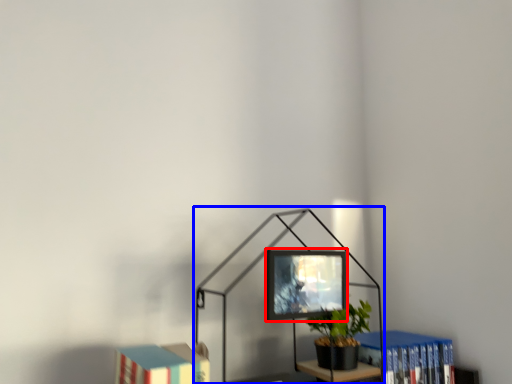
Question: Which of the following is the closest to the observer, computer monitor (highlighted by a red box) or table lamp (highlighted by a blue box)?

Choices:
 (A) computer monitor
 (B) table lamp

Answer: (B)